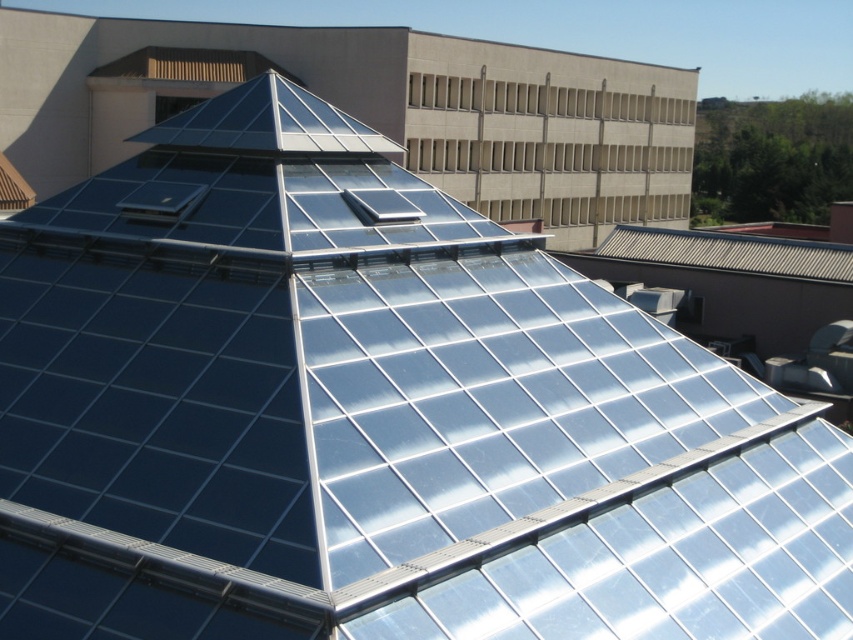
Is black glossy solar battery at upper left thinner than transparent glass solar battery at center?

No, black glossy solar battery at upper left is not thinner than transparent glass solar battery at center.

This screenshot has height=640, width=853. Find the location of `black glossy solar battery at upper left`. black glossy solar battery at upper left is located at coordinates (161, 200).

Is point (148, 196) positioned after point (370, 198)?

No, (148, 196) is closer to viewer.

Image resolution: width=853 pixels, height=640 pixels. I want to click on black glossy solar battery at upper left, so click(161, 200).